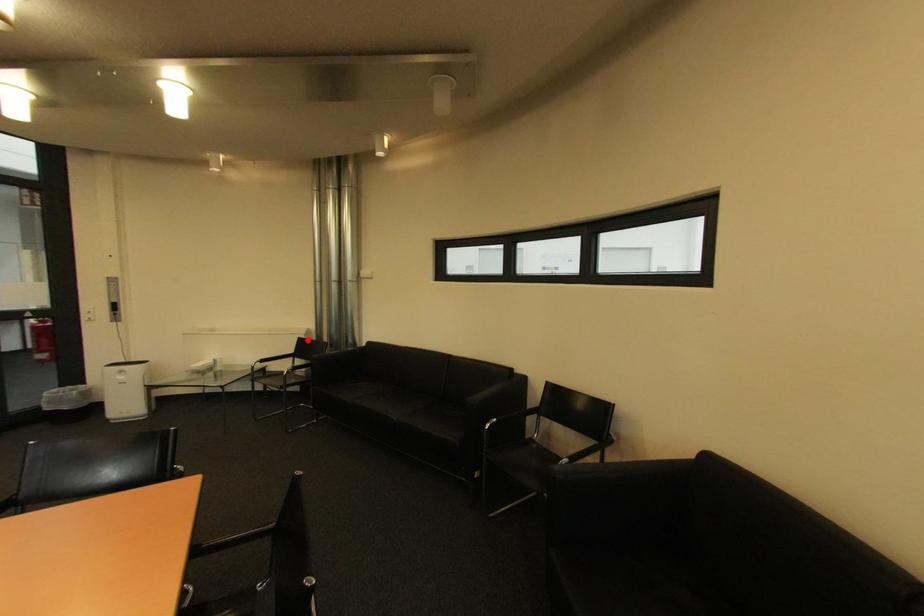
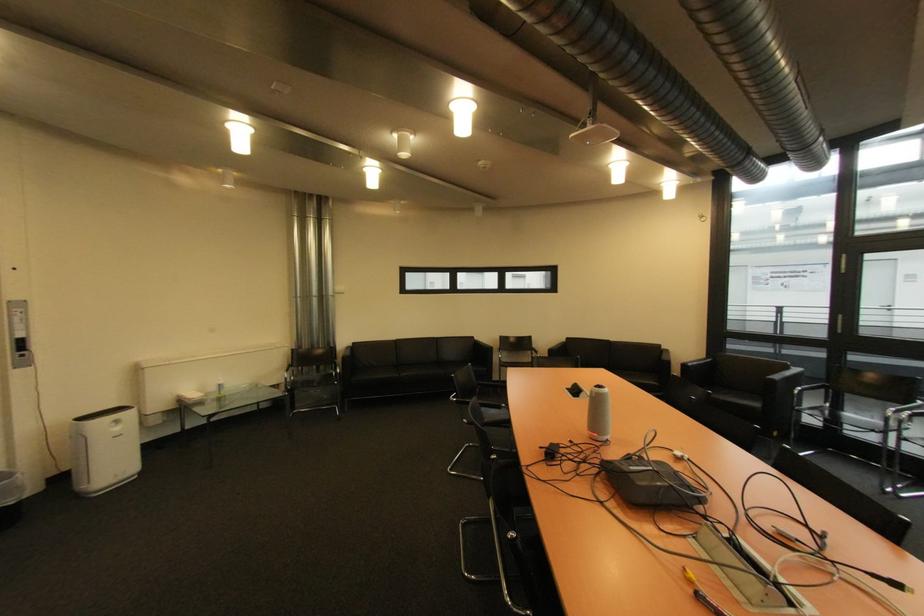
Where in the second image is the point corresponding to the highlighted location from the first image?

(301, 352)